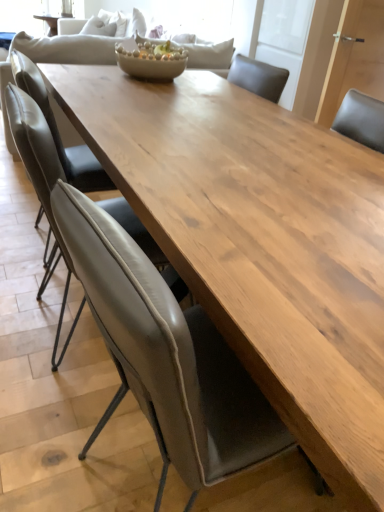
Measure the distance between leather at center, which is counted as the third chair, starting from the back, and camera.

The distance of leather at center, which is counted as the third chair, starting from the back, from camera is 20.97 inches.

Identify the location of leather at center, which is counted as the third chair, starting from the back. (x=167, y=355).

At what (x,y) coordinates should I click in order to perform the action: click on matte ceramic bowl at center. Please return your answer as a coordinate pair (x, y). Looking at the image, I should click on (151, 59).

What do you see at coordinates (58, 131) in the screenshot? This screenshot has height=512, width=384. I see `leather at left, arranged as the first chair when viewed from the back` at bounding box center [58, 131].

The height and width of the screenshot is (512, 384). What are the coordinates of `matte gray chair at center, the second chair viewed from the back` in the screenshot? It's located at (41, 184).

Based on the photo, considering the relative sizes of matte gray chair at center, the 2th chair in the front-to-back sequence, and matte ceramic bowl at center in the image provided, is matte gray chair at center, the 2th chair in the front-to-back sequence, taller than matte ceramic bowl at center?

Yes.

Can you see matte gray chair at center, the second chair viewed from the back, touching matte ceramic bowl at center?

No, matte gray chair at center, the second chair viewed from the back, is not touching matte ceramic bowl at center.

From the picture: Is matte gray chair at center, the second chair viewed from the back, oriented away from matte ceramic bowl at center?

No, matte ceramic bowl at center is not at the back of matte gray chair at center, the second chair viewed from the back.

Is matte gray chair at center, the second chair viewed from the back, wider or thinner than matte ceramic bowl at center?

In the image, matte gray chair at center, the second chair viewed from the back, appears to be wider than matte ceramic bowl at center.

Considering the sizes of objects leather at left, arranged as the first chair when viewed from the back, and leather at center, which is counted as the third chair, starting from the back, in the image provided, who is shorter, leather at left, arranged as the first chair when viewed from the back, or leather at center, which is counted as the third chair, starting from the back,?

leather at left, arranged as the first chair when viewed from the back, is shorter.

Based on the photo, is leather at left, arranged as the first chair when viewed from the back, positioned beyond the bounds of leather at center, which is the 1th chair from front to back?

leather at left, arranged as the first chair when viewed from the back, lies outside leather at center, which is the 1th chair from front to back,'s area.

From a real-world perspective, is leather at left, arranged as the first chair when viewed from the back, positioned above or below leather at center, which is counted as the third chair, starting from the back?

leather at left, arranged as the first chair when viewed from the back, is situated higher than leather at center, which is counted as the third chair, starting from the back, in the real world.

Is leather at left, arranged as the first chair when viewed from the back, aimed at leather at center, which is counted as the third chair, starting from the back?

No, leather at left, arranged as the first chair when viewed from the back, is not oriented towards leather at center, which is counted as the third chair, starting from the back.

Is leather at center, which is counted as the third chair, starting from the back, wider or thinner than matte ceramic bowl at center?

leather at center, which is counted as the third chair, starting from the back, is wider than matte ceramic bowl at center.

In the scene shown: Does leather at center, which is counted as the third chair, starting from the back, lie behind matte ceramic bowl at center?

No, leather at center, which is counted as the third chair, starting from the back, is closer to the camera.

Which is in front, point (192, 435) or point (166, 62)?

The point (192, 435) is closer to the camera.

Considering the relative sizes of leather at center, which is the 1th chair from front to back, and matte ceramic bowl at center in the image provided, is leather at center, which is the 1th chair from front to back, smaller than matte ceramic bowl at center?

Incorrect, leather at center, which is the 1th chair from front to back, is not smaller in size than matte ceramic bowl at center.

Between matte gray chair at center, the 2th chair in the front-to-back sequence, and leather at center, which is counted as the third chair, starting from the back, which one is positioned behind?

Positioned behind is matte gray chair at center, the 2th chair in the front-to-back sequence.

Which object is thinner, matte gray chair at center, the second chair viewed from the back, or leather at center, which is the 1th chair from front to back?

matte gray chair at center, the second chair viewed from the back, is thinner.

Is point (45, 202) closer or farther from the camera than point (119, 331)?

Point (45, 202) is farther from the camera than point (119, 331).

Which point is more distant from viewer, [73,149] or [46,136]?

The point [73,149] is farther.

From a real-world perspective, is leather at left, the third chair positioned from the front, physically above matte gray chair at center, the 2th chair in the front-to-back sequence?

Yes.

Would you say matte gray chair at center, the 2th chair in the front-to-back sequence, is part of leather at left, the third chair positioned from the front,'s contents?

No, matte gray chair at center, the 2th chair in the front-to-back sequence, is not inside leather at left, the third chair positioned from the front.

Consider the image. Is matte gray chair at center, the 2th chair in the front-to-back sequence, at the back of leather at left, the third chair positioned from the front?

Answer: No, leather at left, the third chair positioned from the front, is not facing away from matte gray chair at center, the 2th chair in the front-to-back sequence.

Is leather at center, which is the 1th chair from front to back, taller or shorter than matte gray chair at center, the 2th chair in the front-to-back sequence?

In the image, leather at center, which is the 1th chair from front to back, appears to be taller than matte gray chair at center, the 2th chair in the front-to-back sequence.

Considering the sizes of objects leather at center, which is the 1th chair from front to back, and matte gray chair at center, the 2th chair in the front-to-back sequence, in the image provided, who is wider, leather at center, which is the 1th chair from front to back, or matte gray chair at center, the 2th chair in the front-to-back sequence,?

Wider between the two is leather at center, which is the 1th chair from front to back.

Which point is more forward, (112, 288) or (60, 177)?

Point (112, 288)

Is leather at center, which is the 1th chair from front to back, facing away from matte gray chair at center, the second chair viewed from the back?

No, leather at center, which is the 1th chair from front to back,'s orientation is not away from matte gray chair at center, the second chair viewed from the back.

Is matte ceramic bowl at center smaller than matte gray chair at center, the 2th chair in the front-to-back sequence?

Yes.

How much distance is there between matte ceramic bowl at center and matte gray chair at center, the 2th chair in the front-to-back sequence?

The distance of matte ceramic bowl at center from matte gray chair at center, the 2th chair in the front-to-back sequence, is 3.67 feet.

Considering the relative sizes of matte ceramic bowl at center and matte gray chair at center, the 2th chair in the front-to-back sequence, in the image provided, is matte ceramic bowl at center taller than matte gray chair at center, the 2th chair in the front-to-back sequence,?

In fact, matte ceramic bowl at center may be shorter than matte gray chair at center, the 2th chair in the front-to-back sequence.

Is matte ceramic bowl at center situated inside matte gray chair at center, the 2th chair in the front-to-back sequence, or outside?

matte ceramic bowl at center is located beyond the bounds of matte gray chair at center, the 2th chair in the front-to-back sequence.

Image resolution: width=384 pixels, height=512 pixels. I want to click on chair that is the 2nd one below the matte ceramic bowl at center (from a real-world perspective), so click(x=41, y=184).

Where is `the 2nd chair in front of the leather at left, arranged as the first chair when viewed from the back`? The height and width of the screenshot is (512, 384). the 2nd chair in front of the leather at left, arranged as the first chair when viewed from the back is located at coordinates [167, 355].

From the image, which object appears to be farther from matte gray chair at center, the 2th chair in the front-to-back sequence, matte ceramic bowl at center or leather at center, which is the 1th chair from front to back?

matte ceramic bowl at center lies further to matte gray chair at center, the 2th chair in the front-to-back sequence, than the other object.

When comparing their distances from leather at center, which is counted as the third chair, starting from the back, does leather at left, the third chair positioned from the front, or matte gray chair at center, the 2th chair in the front-to-back sequence, seem further?

leather at left, the third chair positioned from the front, is further to leather at center, which is counted as the third chair, starting from the back.

Considering their positions, is leather at center, which is the 1th chair from front to back, positioned closer to leather at left, the third chair positioned from the front, than matte gray chair at center, the 2th chair in the front-to-back sequence?

matte gray chair at center, the 2th chair in the front-to-back sequence, is closer to leather at left, the third chair positioned from the front.

Which object lies nearer to the anchor point matte gray chair at center, the 2th chair in the front-to-back sequence, leather at left, the third chair positioned from the front, or leather at center, which is counted as the third chair, starting from the back?

The object closer to matte gray chair at center, the 2th chair in the front-to-back sequence, is leather at left, the third chair positioned from the front.

Based on their spatial positions, is leather at center, which is counted as the third chair, starting from the back, or leather at left, arranged as the first chair when viewed from the back, closer to matte gray chair at center, the second chair viewed from the back?

leather at left, arranged as the first chair when viewed from the back.

Based on their spatial positions, is matte gray chair at center, the second chair viewed from the back, or leather at center, which is the 1th chair from front to back, further from leather at left, the third chair positioned from the front?

leather at center, which is the 1th chair from front to back.

Estimate the real-world distances between objects in this image. Which object is further from leather at left, arranged as the first chair when viewed from the back, matte gray chair at center, the second chair viewed from the back, or matte ceramic bowl at center?

matte ceramic bowl at center lies further to leather at left, arranged as the first chair when viewed from the back, than the other object.

From the image, which object appears to be farther from matte gray chair at center, the second chair viewed from the back, leather at center, which is counted as the third chair, starting from the back, or matte ceramic bowl at center?

matte ceramic bowl at center lies further to matte gray chair at center, the second chair viewed from the back, than the other object.

Where is `chair located between leather at center, which is the 1th chair from front to back, and leather at left, the third chair positioned from the front, in the depth direction`? The height and width of the screenshot is (512, 384). chair located between leather at center, which is the 1th chair from front to back, and leather at left, the third chair positioned from the front, in the depth direction is located at coordinates (41, 184).

Identify the location of chair located between matte gray chair at center, the second chair viewed from the back, and matte ceramic bowl at center in the depth direction. (58, 131).